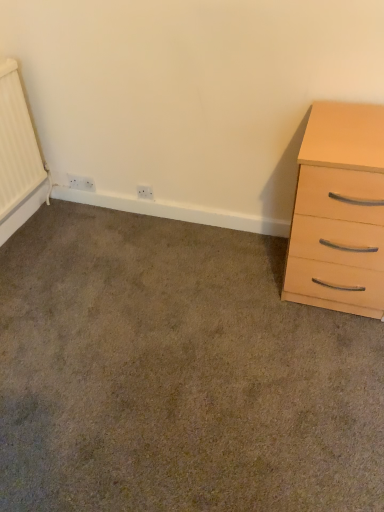
Where is `free space above light wood/veneer chest of drawers at right (from a real-world perspective)`? Image resolution: width=384 pixels, height=512 pixels. free space above light wood/veneer chest of drawers at right (from a real-world perspective) is located at coordinates (356, 122).